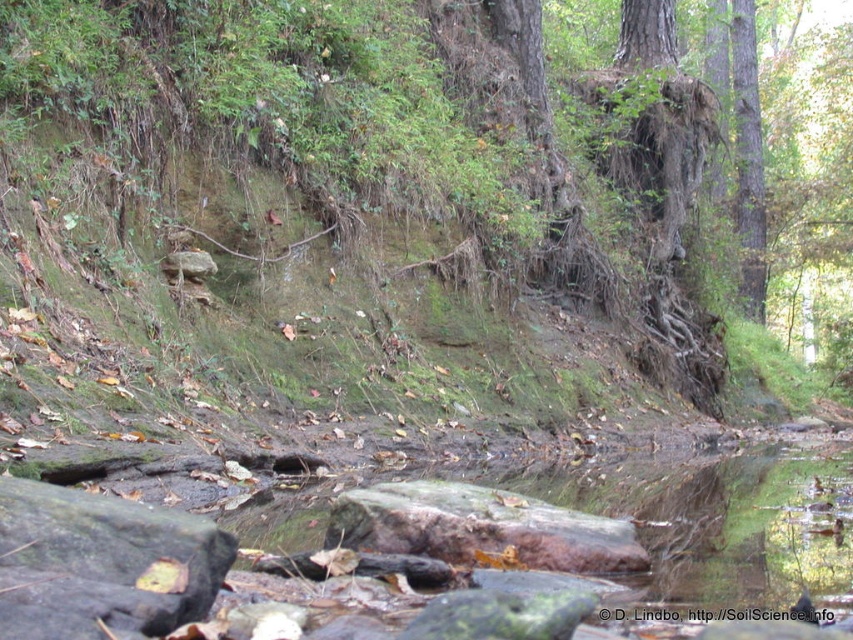
Question: Is green mossy rock at lower left to the left of rusty wood log at center from the viewer's perspective?

Choices:
 (A) yes
 (B) no

Answer: (A)

Question: Is green mossy rock at lower left below green rough bark tree at right?

Choices:
 (A) yes
 (B) no

Answer: (A)

Question: Considering the relative positions of rusty wood log at center and green rough bark tree at right in the image provided, where is rusty wood log at center located with respect to green rough bark tree at right?

Choices:
 (A) left
 (B) right

Answer: (A)

Question: Which of these objects is positioned closest to the green rough bark tree at right?

Choices:
 (A) green mossy rock at lower left
 (B) rusty wood log at center

Answer: (B)

Question: Based on their relative distances, which object is nearer to the green rough bark tree at right?

Choices:
 (A) rusty wood log at center
 (B) green mossy rock at lower left

Answer: (A)

Question: Which point appears farthest from the camera in this image?

Choices:
 (A) (761, 260)
 (B) (492, 496)

Answer: (A)